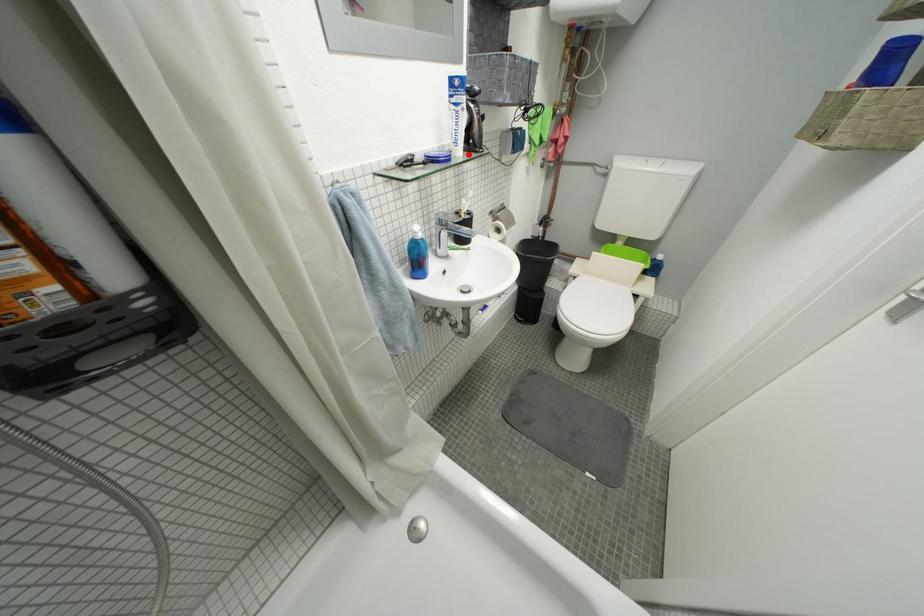
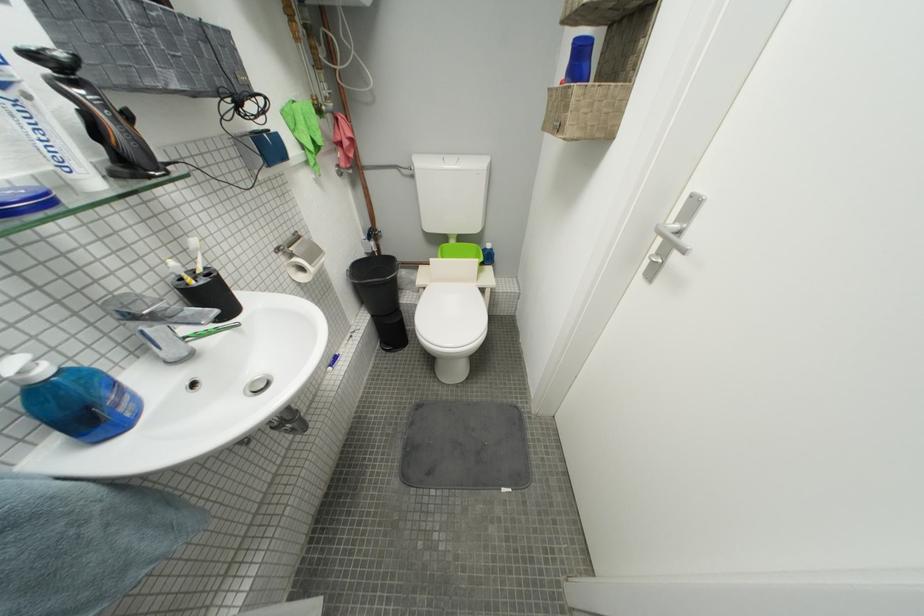
The point at the highlighted location is marked in the first image. Where is the corresponding point in the second image?

(103, 185)